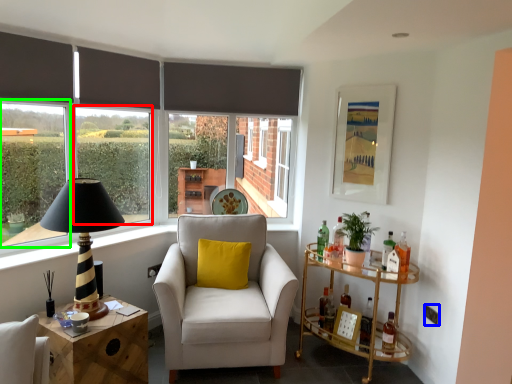
Question: Which object is the farthest from window (highlighted by a red box)? Choose among these: power outlet (highlighted by a blue box) or window screen (highlighted by a green box).

Choices:
 (A) power outlet
 (B) window screen

Answer: (A)